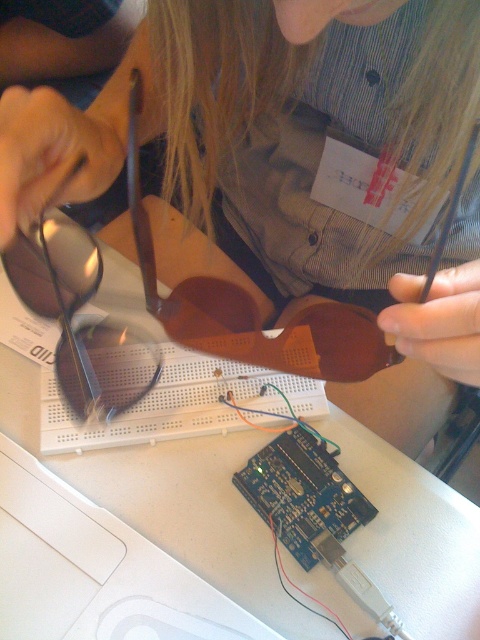
Question: Is matte brown sunglasses at center smaller than matte brown goggles at upper left?

Choices:
 (A) yes
 (B) no

Answer: (B)

Question: Among these objects, which one is farthest from the camera?

Choices:
 (A) matte brown goggles at upper left
 (B) matte brown sunglasses at center

Answer: (A)

Question: Which point is farther from the camera taking this photo?

Choices:
 (A) (137, 362)
 (B) (444, 365)

Answer: (A)

Question: Which object is farther from the camera taking this photo?

Choices:
 (A) matte brown goggles at upper left
 (B) matte brown sunglasses at center

Answer: (A)

Question: Can you confirm if matte brown sunglasses at center is positioned below matte brown goggles at upper left?

Choices:
 (A) no
 (B) yes

Answer: (A)

Question: Is matte brown sunglasses at center to the right of matte brown goggles at upper left from the viewer's perspective?

Choices:
 (A) no
 (B) yes

Answer: (B)